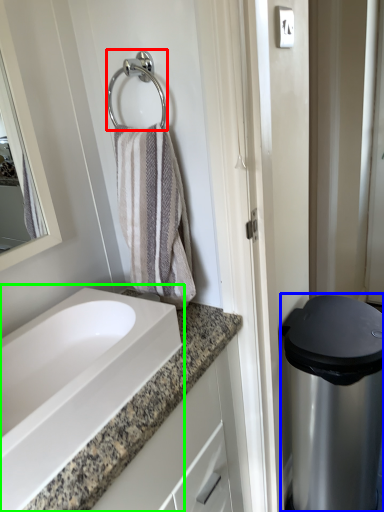
Question: Based on their relative distances, which object is nearer to shower (highlighted by a red box)? Choose from appliance (highlighted by a blue box) and sink (highlighted by a green box).

Choices:
 (A) appliance
 (B) sink

Answer: (B)